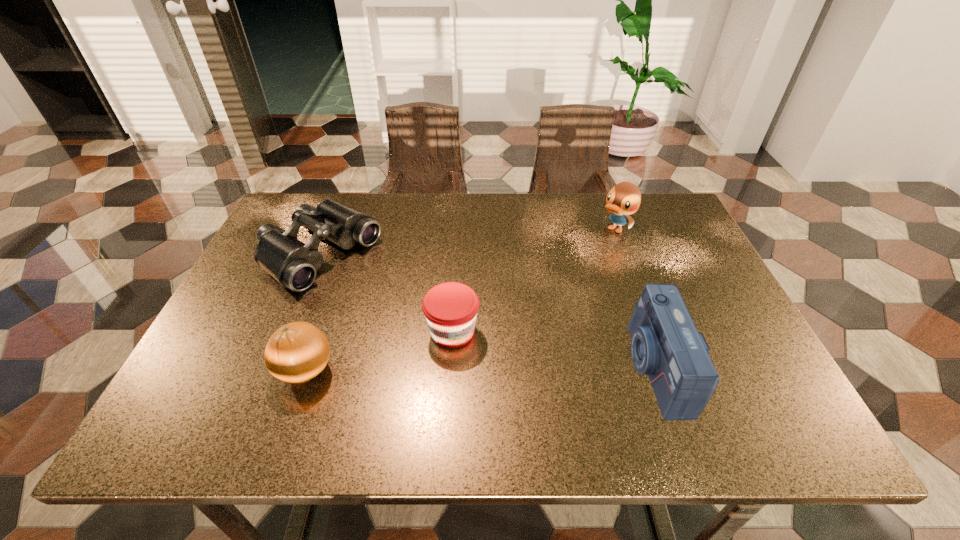
Locate an element on the screen. free space at the right edge of the desktop is located at coordinates (712, 286).

In the image, there is a desktop. What are the coordinates of `blank space at the near right corner` in the screenshot? It's located at (758, 382).

In order to click on vacant area between the third object from right to left and the camera in this screenshot , I will do `click(554, 349)`.

Identify the location of unoccupied area between the duck and the binoculars. The width and height of the screenshot is (960, 540). (468, 242).

Locate an element on the screen. The height and width of the screenshot is (540, 960). empty location between the binoculars and the shortest object is located at coordinates (386, 293).

The height and width of the screenshot is (540, 960). Find the location of `free space between the orange and the binoculars`. free space between the orange and the binoculars is located at coordinates (312, 313).

Where is `free spot between the binoculars and the camera`? Image resolution: width=960 pixels, height=540 pixels. free spot between the binoculars and the camera is located at coordinates (487, 312).

Locate an element on the screen. The height and width of the screenshot is (540, 960). vacant space in between the camera and the duck is located at coordinates (635, 299).

Where is `empty space between the duck and the binoculars`? The height and width of the screenshot is (540, 960). empty space between the duck and the binoculars is located at coordinates coord(468,242).

This screenshot has height=540, width=960. Identify the location of free space between the camera and the duck. (635, 299).